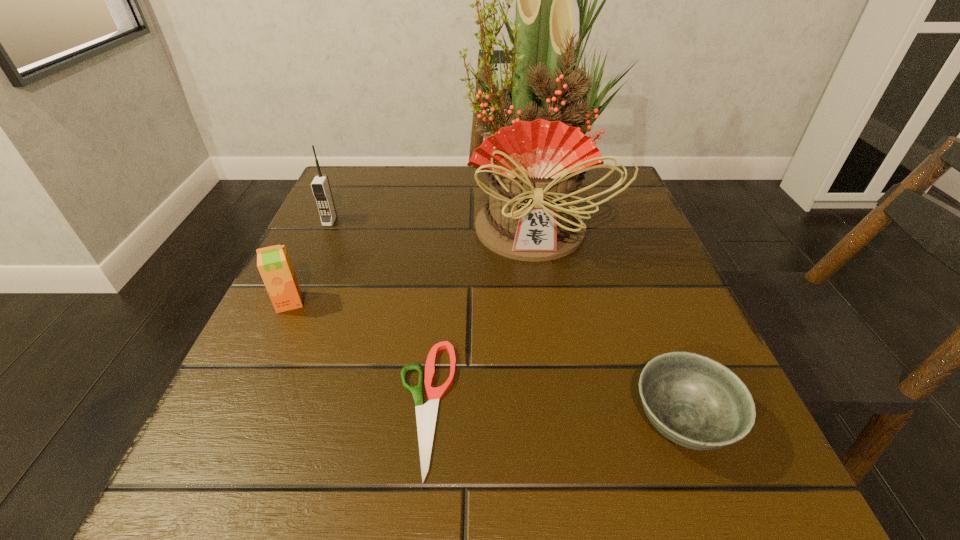
At what (x,y) coordinates should I click in order to perform the action: click on free area in between the third tallest object and the second shortest object. Please return your answer as a coordinate pair (x, y). Looking at the image, I should click on (485, 362).

The image size is (960, 540). I want to click on vacant area between the fourth shortest object and the third farthest object, so click(309, 262).

Identify the location of free space that is in between the bowl and the scissors. The height and width of the screenshot is (540, 960). (553, 414).

You are a GUI agent. You are given a task and a screenshot of the screen. Output one action in this format:
    pyautogui.click(x=<x>, y=<y>)
    Task: Click on the vacant area that lies between the fourth shortest object and the second shortest object
    This screenshot has width=960, height=540.
    Given the screenshot: What is the action you would take?
    pyautogui.click(x=506, y=321)

Where is `vacant space in between the tallest object and the fourth shortest object`? This screenshot has height=540, width=960. vacant space in between the tallest object and the fourth shortest object is located at coordinates (431, 220).

Identify the location of empty space between the second shortest object and the second tallest object. The width and height of the screenshot is (960, 540). (506, 321).

Where is `empty space that is in between the third shortest object and the flower arrangement`? The image size is (960, 540). empty space that is in between the third shortest object and the flower arrangement is located at coordinates (411, 261).

Find the location of a particular element. This screenshot has height=540, width=960. vacant space that's between the third shortest object and the tallest object is located at coordinates (411, 261).

Image resolution: width=960 pixels, height=540 pixels. Identify the location of free space between the shortest object and the third nearest object. (357, 354).

At what (x,y) coordinates should I click in order to perform the action: click on object identified as the fourth closest to the fourth tallest object. Please return your answer as a coordinate pair (x, y). The image size is (960, 540). Looking at the image, I should click on (320, 185).